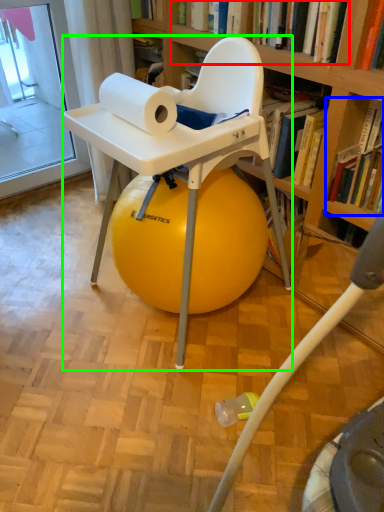
Question: Estimate the real-world distances between objects in this image. Which object is farther from book (highlighted by a red box), book (highlighted by a blue box) or chair (highlighted by a green box)?

Choices:
 (A) book
 (B) chair

Answer: (B)